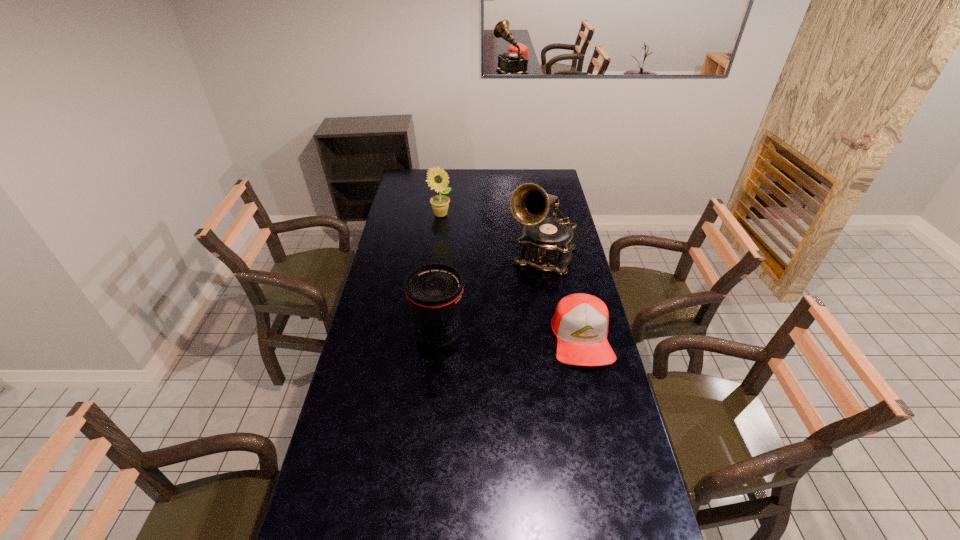
The height and width of the screenshot is (540, 960). I want to click on telephoto lens, so click(x=434, y=291).

Find the location of a particular element. The width and height of the screenshot is (960, 540). baseball cap is located at coordinates tap(580, 322).

You are a GUI agent. You are given a task and a screenshot of the screen. Output one action in this format:
    pyautogui.click(x=<x>, y=<y>)
    Task: Click on the tallest object
    The height and width of the screenshot is (540, 960).
    Given the screenshot: What is the action you would take?
    pyautogui.click(x=546, y=244)

You are a GUI agent. You are given a task and a screenshot of the screen. Output one action in this format:
    pyautogui.click(x=<x>, y=<y>)
    Task: Click on the third nearest object
    This screenshot has width=960, height=540.
    Given the screenshot: What is the action you would take?
    pyautogui.click(x=546, y=244)

At what (x,y) coordinates should I click in order to perform the action: click on sunflower. Please return your answer as a coordinate pair (x, y). Looking at the image, I should click on (437, 179).

Locate an element on the screen. vacant space located 0.350m on the front of the telephoto lens is located at coordinates (428, 451).

Locate an element on the screen. The image size is (960, 540). free space located 0.350m on the front-facing side of the baseball cap is located at coordinates (612, 470).

Where is `free space located 0.070m on the horn of the tallest object`? This screenshot has width=960, height=540. free space located 0.070m on the horn of the tallest object is located at coordinates (529, 287).

Find the location of a particular element. The width and height of the screenshot is (960, 540). vacant space located on the horn of the tallest object is located at coordinates (519, 309).

At what (x,y) coordinates should I click in order to perform the action: click on free space located on the horn of the tallest object. Please return your answer as a coordinate pair (x, y). Looking at the image, I should click on (521, 305).